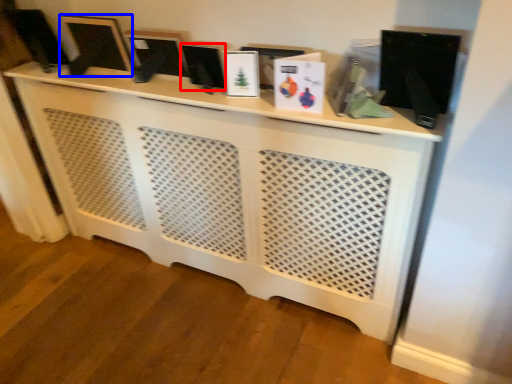
Question: Which object appears closest to the camera in this image, computer monitor (highlighted by a red box) or computer monitor (highlighted by a blue box)?

Choices:
 (A) computer monitor
 (B) computer monitor

Answer: (A)